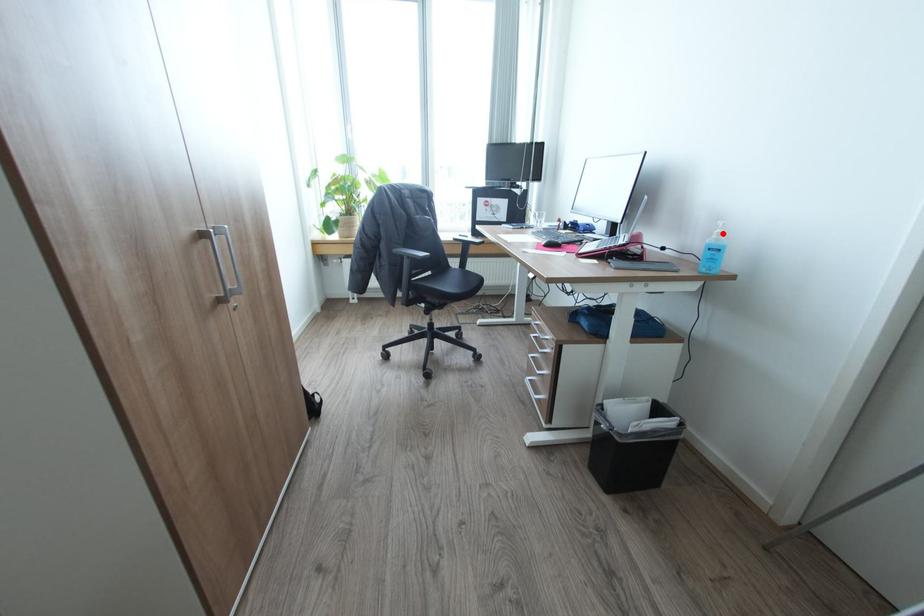
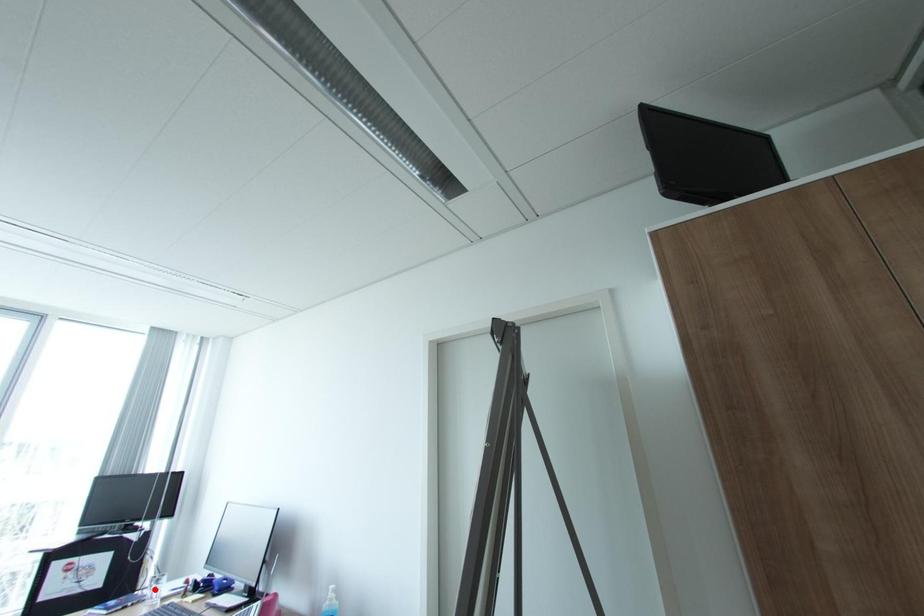
I am providing you with two images of the same scene from different viewpoints. A red point is marked on the first image and another point is marked on the second image. Does the point marked in image1 correspond to the same location as the one in image2?

No